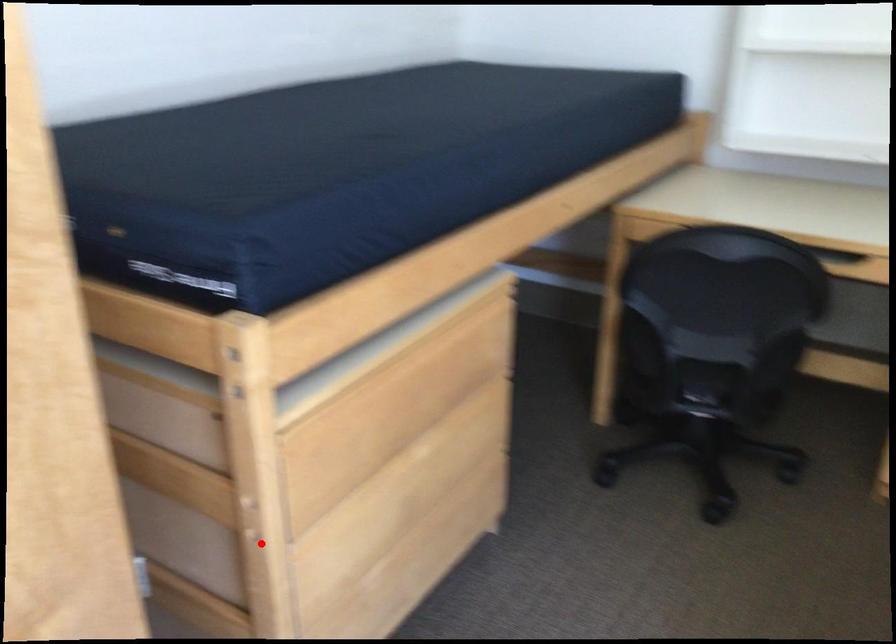
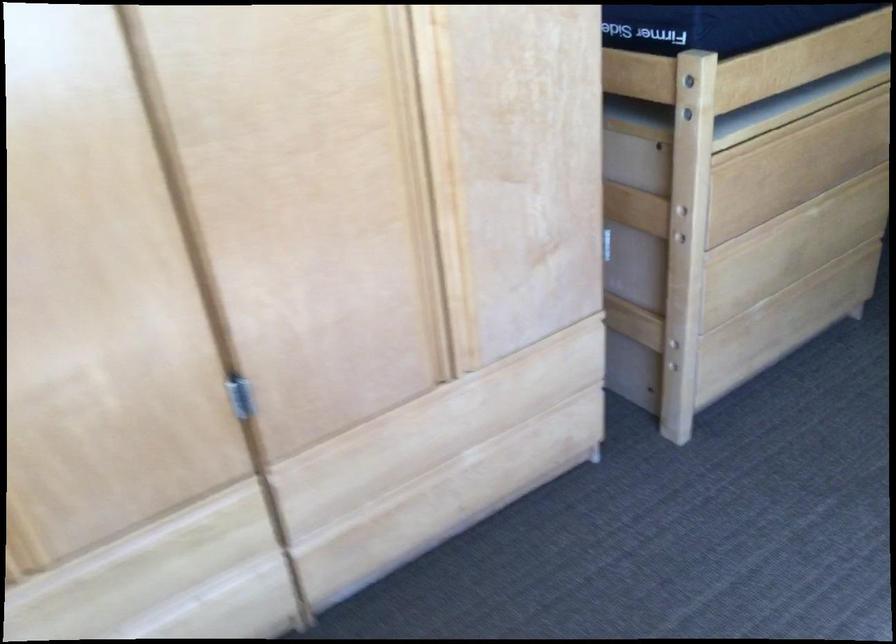
Question: I am providing you with two images of the same scene from different viewpoints. Image1 has a red point marked. In image2, the corresponding 3D location appears at what relative position? Reply with the corresponding letter.

Choices:
 (A) Closer
 (B) Farther

Answer: (B)